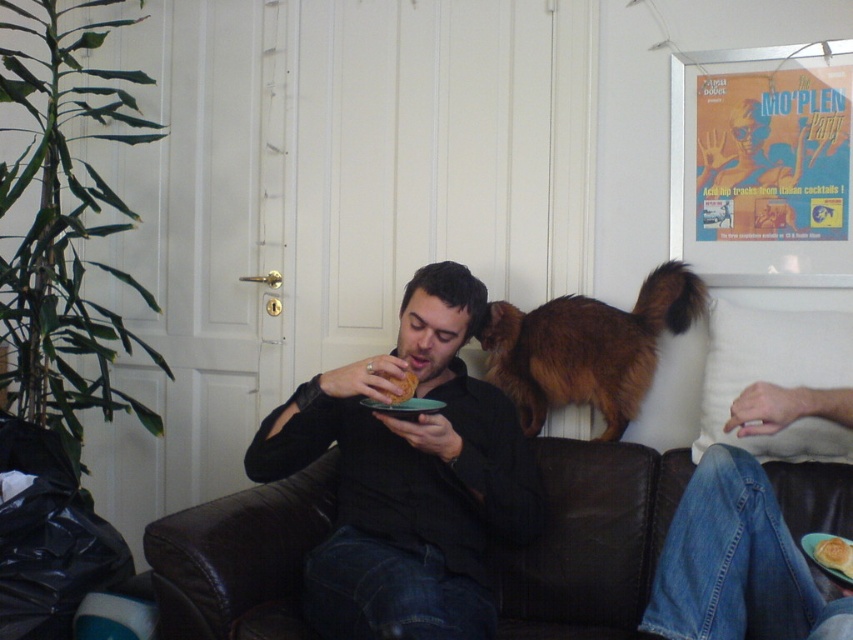
Does black matte shirt at center have a larger size compared to brown fluffy cat at upper right?

Yes.

Can you confirm if black matte shirt at center is wider than brown fluffy cat at upper right?

Correct, the width of black matte shirt at center exceeds that of brown fluffy cat at upper right.

Is point (334, 424) more distant than point (523, 381)?

No, (334, 424) is closer to viewer.

Locate an element on the screen. black matte shirt at center is located at coordinates (409, 477).

Which is above, brown fluffy cat at upper right or matte black plate at lower center?

brown fluffy cat at upper right

Does brown fluffy cat at upper right come in front of matte black plate at lower center?

No, brown fluffy cat at upper right is behind matte black plate at lower center.

Is point (666, 268) closer to viewer compared to point (390, 404)?

No.

You are a GUI agent. You are given a task and a screenshot of the screen. Output one action in this format:
    pyautogui.click(x=<x>, y=<y>)
    Task: Click on the brown fluffy cat at upper right
    The image size is (853, 640).
    Given the screenshot: What is the action you would take?
    pyautogui.click(x=587, y=348)

Is black matte shirt at center bigger than golden crispy bread at lower right?

Indeed, black matte shirt at center has a larger size compared to golden crispy bread at lower right.

In the scene shown: Is black matte shirt at center to the right of golden crispy bread at lower right from the viewer's perspective?

In fact, black matte shirt at center is to the left of golden crispy bread at lower right.

Describe the element at coordinates (409, 477) in the screenshot. I see `black matte shirt at center` at that location.

Locate an element on the screen. The image size is (853, 640). black matte shirt at center is located at coordinates (409, 477).